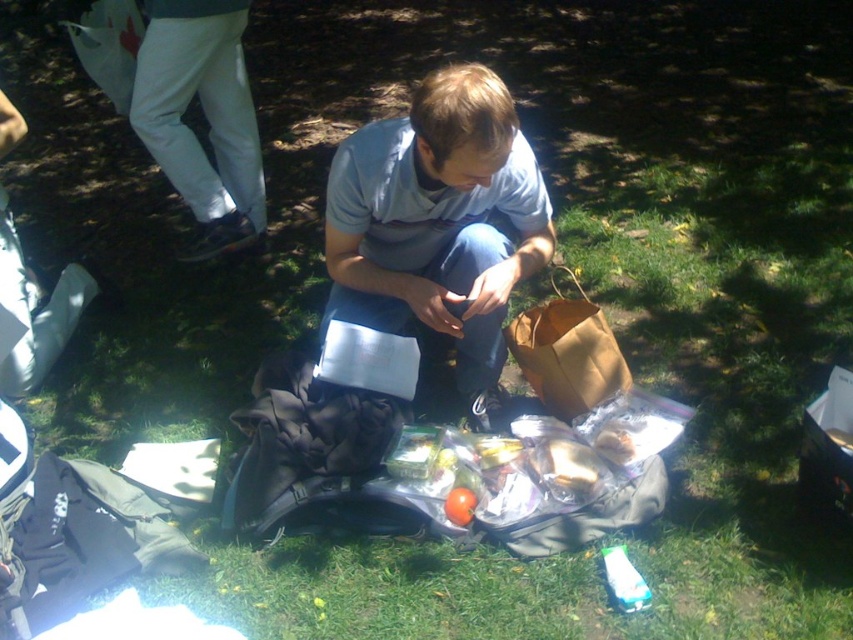
Question: Which object is closer to the camera taking this photo?

Choices:
 (A) clear plastic bottle at lower center
 (B) brown paper bag at center
 (C) matte gray shirt at center
 (D) shiny plastic container at center

Answer: (C)

Question: Considering the real-world distances, which object is closest to the brown paper bag at center?

Choices:
 (A) matte gray shirt at center
 (B) clear plastic bottle at lower center

Answer: (A)

Question: Is matte gray shirt at center behind shiny plastic container at center?

Choices:
 (A) yes
 (B) no

Answer: (B)

Question: Does matte gray shirt at center appear under shiny plastic container at center?

Choices:
 (A) yes
 (B) no

Answer: (B)

Question: Among these objects, which one is farthest from the camera?

Choices:
 (A) shiny plastic container at center
 (B) clear plastic bottle at lower center
 (C) matte gray shirt at center
 (D) brown paper bag at center

Answer: (D)

Question: Does clear plastic bottle at lower center appear under shiny plastic container at center?

Choices:
 (A) yes
 (B) no

Answer: (A)